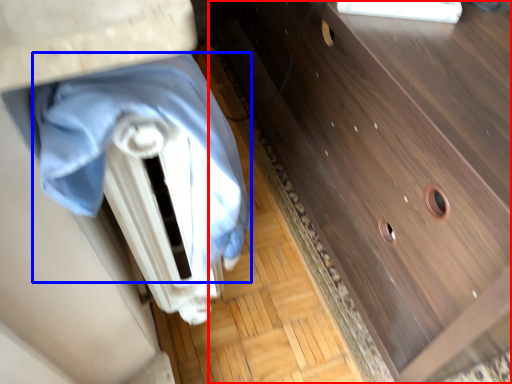
Question: Among these objects, which one is farthest to the camera, chest of drawers (highlighted by a red box) or blanket (highlighted by a blue box)?

Choices:
 (A) chest of drawers
 (B) blanket

Answer: (A)